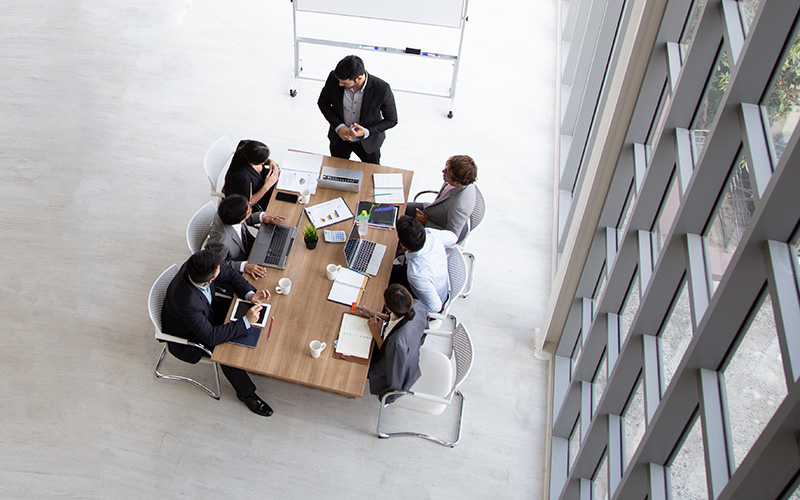
Identify the location of coffee cups. The height and width of the screenshot is (500, 800). (302, 195), (285, 289), (314, 343), (330, 271).